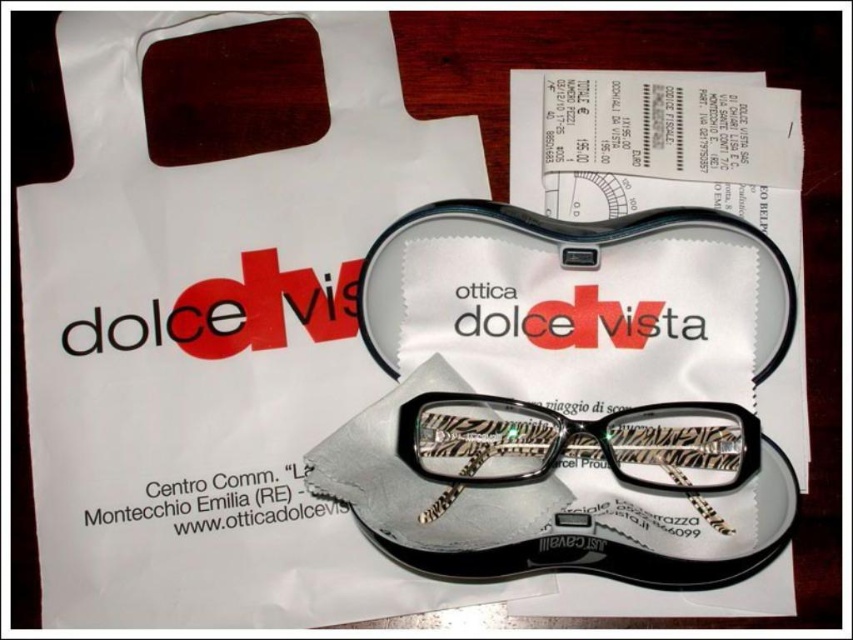
You are looking at the image of the items on the wooden table. There are two points marked on the table surface. Which of the two points, point 1 at coordinates (691, 445) or point 2 at (488, 220), is closer to you?

Point 1 at coordinates (691, 445) is closer to the viewer than point 2 at (488, 220).